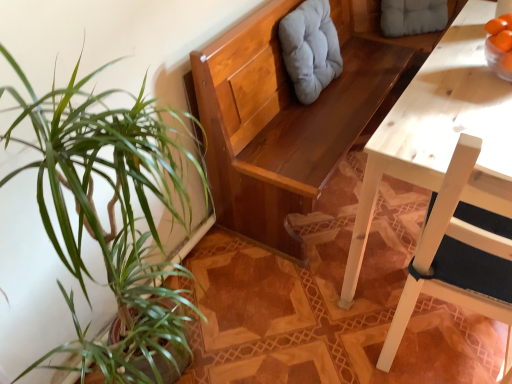
You are a GUI agent. You are given a task and a screenshot of the screen. Output one action in this format:
    pyautogui.click(x=<x>, y=<y>)
    Task: Click on the light gray fabric cushion at upper center, the first swivel chair when ordered from front to back
    This screenshot has width=512, height=384.
    Given the screenshot: What is the action you would take?
    pyautogui.click(x=310, y=49)

Identify the location of white wood chair at right. The width and height of the screenshot is (512, 384). (457, 258).

The image size is (512, 384). I want to click on light gray fabric cushion at upper center, the first swivel chair when ordered from front to back, so click(310, 49).

Which is less distant, (507, 376) or (442, 16)?

Point (507, 376).

Between white wood chair at right and gray fabric cushion at upper center, which ranks as the second swivel chair in front-to-back order, which one is positioned behind?

Positioned behind is gray fabric cushion at upper center, which ranks as the second swivel chair in front-to-back order.

Considering the positions of objects white wood chair at right and gray fabric cushion at upper center, acting as the first swivel chair starting from the right, in the image provided, who is more to the left, white wood chair at right or gray fabric cushion at upper center, acting as the first swivel chair starting from the right,?

white wood chair at right is more to the left.

Considering the sizes of objects gray fabric cushion at upper center, which appears as the first swivel chair when viewed from the back, and white wood chair at right in the image provided, who is thinner, gray fabric cushion at upper center, which appears as the first swivel chair when viewed from the back, or white wood chair at right?

With smaller width is gray fabric cushion at upper center, which appears as the first swivel chair when viewed from the back.

Is gray fabric cushion at upper center, acting as the first swivel chair starting from the right, positioned with its back to white wood chair at right?

gray fabric cushion at upper center, acting as the first swivel chair starting from the right, is not turned away from white wood chair at right.

Is gray fabric cushion at upper center, which ranks as the second swivel chair in front-to-back order, bigger than white wood chair at right?

No.

Is gray fabric cushion at upper center, acting as the first swivel chair starting from the right, surrounding white wood chair at right?

No.

Considering the positions of objects gray fabric cushion at upper center, acting as the first swivel chair starting from the right, and light gray fabric cushion at upper center, the first swivel chair when ordered from front to back, in the image provided, who is in front, gray fabric cushion at upper center, acting as the first swivel chair starting from the right, or light gray fabric cushion at upper center, the first swivel chair when ordered from front to back,?

light gray fabric cushion at upper center, the first swivel chair when ordered from front to back, is in front.

Is there a large distance between gray fabric cushion at upper center, which ranks as the second swivel chair in front-to-back order, and light gray fabric cushion at upper center, marked as the 2th swivel chair in a right-to-left arrangement?

gray fabric cushion at upper center, which ranks as the second swivel chair in front-to-back order, is near light gray fabric cushion at upper center, marked as the 2th swivel chair in a right-to-left arrangement, not far away.

Considering the points (445, 24) and (320, 5), which point is behind, point (445, 24) or point (320, 5)?

Positioned behind is point (445, 24).

Between gray fabric cushion at upper center, which ranks as the second swivel chair in front-to-back order, and light gray fabric cushion at upper center, marked as the 2th swivel chair in a right-to-left arrangement, which one has smaller width?

With smaller width is light gray fabric cushion at upper center, marked as the 2th swivel chair in a right-to-left arrangement.

Does white wood chair at right turn towards light gray fabric cushion at upper center, the 1th swivel chair in the left-to-right sequence?

No, white wood chair at right is not facing towards light gray fabric cushion at upper center, the 1th swivel chair in the left-to-right sequence.

Is white wood chair at right smaller than light gray fabric cushion at upper center, the second swivel chair from the back?

Actually, white wood chair at right might be larger than light gray fabric cushion at upper center, the second swivel chair from the back.

From the image's perspective, between white wood chair at right and light gray fabric cushion at upper center, the first swivel chair when ordered from front to back, who is located below?

From the image's view, white wood chair at right is below.

Is white wood chair at right not within light gray fabric cushion at upper center, the 1th swivel chair in the left-to-right sequence?

white wood chair at right lies outside light gray fabric cushion at upper center, the 1th swivel chair in the left-to-right sequence,'s area.

From the image's perspective, is light gray fabric cushion at upper center, the second swivel chair from the back, on gray fabric cushion at upper center, the 2th swivel chair positioned from the left?

No.

From a real-world perspective, is light gray fabric cushion at upper center, the second swivel chair from the back, physically below gray fabric cushion at upper center, which ranks as the second swivel chair in front-to-back order?

Actually, light gray fabric cushion at upper center, the second swivel chair from the back, is physically above gray fabric cushion at upper center, which ranks as the second swivel chair in front-to-back order, in the real world.

From a real-world perspective, which object rests below the other?

white wood chair at right is physically lower.

Considering the positions of objects light gray fabric cushion at upper center, the 1th swivel chair in the left-to-right sequence, and white wood chair at right in the image provided, who is more to the right, light gray fabric cushion at upper center, the 1th swivel chair in the left-to-right sequence, or white wood chair at right?

Result: white wood chair at right.

This screenshot has width=512, height=384. Identify the location of swivel chair that is the 1st object located above the white wood chair at right (from the image's perspective). (310, 49).

The image size is (512, 384). I want to click on the 2nd swivel chair positioned above the white wood chair at right (from the image's perspective), so click(412, 16).

The width and height of the screenshot is (512, 384). What are the coordinates of `chair on the left of gray fabric cushion at upper center, which appears as the first swivel chair when viewed from the back` in the screenshot? It's located at (457, 258).

Which object lies further to the anchor point light gray fabric cushion at upper center, the first swivel chair when ordered from front to back, white wood chair at right or gray fabric cushion at upper center, acting as the first swivel chair starting from the right?

The object further to light gray fabric cushion at upper center, the first swivel chair when ordered from front to back, is white wood chair at right.

Which object lies nearer to the anchor point white wood chair at right, light gray fabric cushion at upper center, the 1th swivel chair in the left-to-right sequence, or gray fabric cushion at upper center, acting as the first swivel chair starting from the right?

light gray fabric cushion at upper center, the 1th swivel chair in the left-to-right sequence, is positioned closer to the anchor white wood chair at right.

Based on their spatial positions, is white wood chair at right or light gray fabric cushion at upper center, marked as the 2th swivel chair in a right-to-left arrangement, further from gray fabric cushion at upper center, acting as the first swivel chair starting from the right?

The object further to gray fabric cushion at upper center, acting as the first swivel chair starting from the right, is white wood chair at right.

Based on their spatial positions, is light gray fabric cushion at upper center, the second swivel chair from the back, or white wood chair at right closer to gray fabric cushion at upper center, acting as the first swivel chair starting from the right?

Based on the image, light gray fabric cushion at upper center, the second swivel chair from the back, appears to be nearer to gray fabric cushion at upper center, acting as the first swivel chair starting from the right.

Consider the image. Which object lies nearer to the anchor point white wood chair at right, gray fabric cushion at upper center, the 2th swivel chair positioned from the left, or light gray fabric cushion at upper center, the 1th swivel chair in the left-to-right sequence?

Among the two, light gray fabric cushion at upper center, the 1th swivel chair in the left-to-right sequence, is located nearer to white wood chair at right.

Considering their positions, is gray fabric cushion at upper center, which ranks as the second swivel chair in front-to-back order, positioned closer to light gray fabric cushion at upper center, the 1th swivel chair in the left-to-right sequence, than white wood chair at right?

gray fabric cushion at upper center, which ranks as the second swivel chair in front-to-back order, lies closer to light gray fabric cushion at upper center, the 1th swivel chair in the left-to-right sequence, than the other object.

In order to click on swivel chair between white wood chair at right and gray fabric cushion at upper center, the 2th swivel chair positioned from the left, from front to back in this screenshot , I will do `click(310, 49)`.